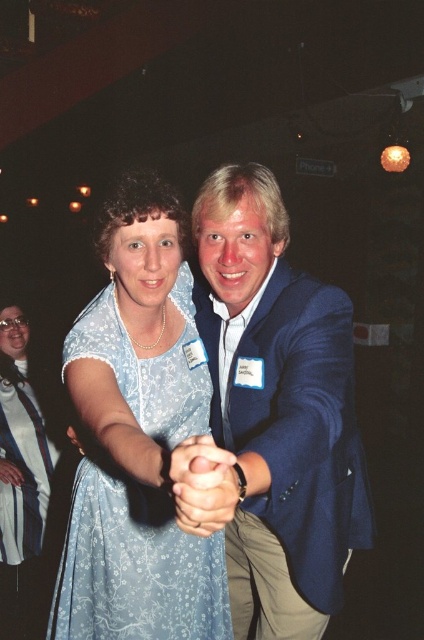
Question: Among these points, which one is farthest from the camera?

Choices:
 (A) (19, 474)
 (B) (331, 484)
 (C) (228, 522)

Answer: (A)

Question: Can you confirm if blue fabric suit at center is thinner than matte blue dress at lower left?

Choices:
 (A) no
 (B) yes

Answer: (A)

Question: Which object appears farthest from the camera in this image?

Choices:
 (A) blue fabric suit at center
 (B) light blue floral dress at center

Answer: (B)

Question: Which of the following is the farthest from the observer?

Choices:
 (A) blue fabric suit at center
 (B) smooth skin hand at center
 (C) matte blue dress at lower left
 (D) light blue floral dress at center

Answer: (C)

Question: Does blue fabric suit at center have a lesser width compared to matte blue dress at lower left?

Choices:
 (A) yes
 (B) no

Answer: (B)

Question: Is blue fabric suit at center positioned in front of smooth skin hand at center?

Choices:
 (A) yes
 (B) no

Answer: (B)